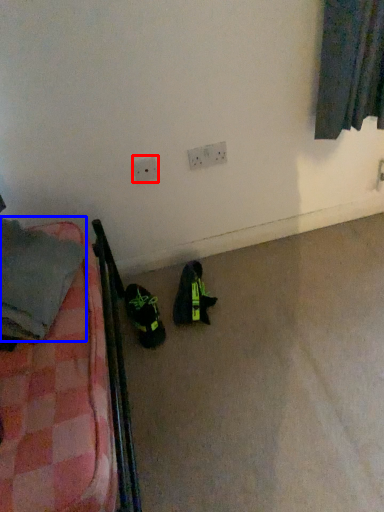
Question: Among these objects, which one is farthest to the camera, electric outlet (highlighted by a red box) or clothing (highlighted by a blue box)?

Choices:
 (A) electric outlet
 (B) clothing

Answer: (A)